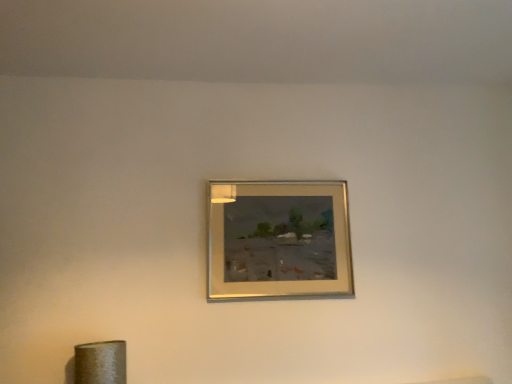
Question: In which direction should I rotate to look at gold metallic picture frame at upper center?

Choices:
 (A) right
 (B) left

Answer: (A)